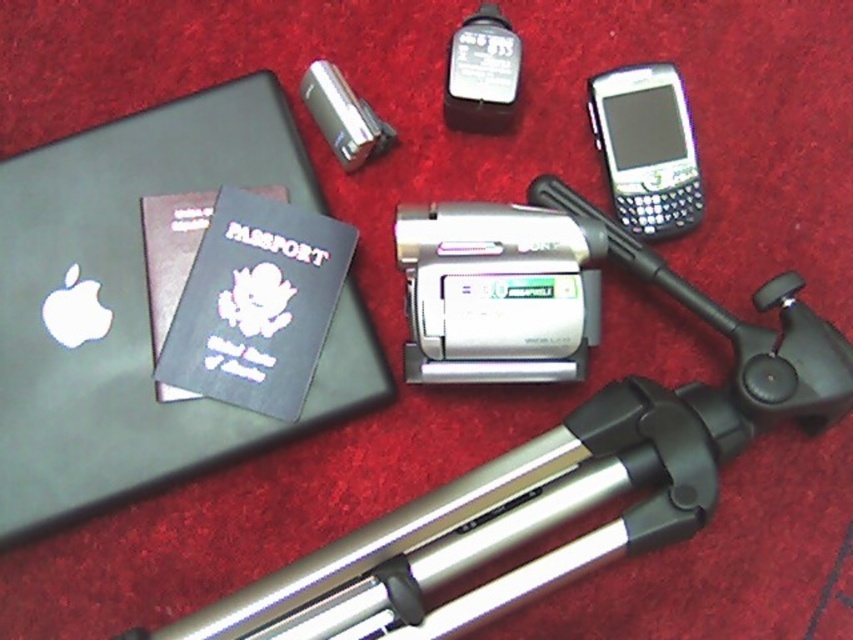
Find the location of a particular element. This screenshot has height=640, width=853. silver metallic video camera at center is located at coordinates (497, 292).

Can you confirm if silver metallic video camera at center is positioned above blue matte passport at center-left?

Yes.

Between point (576, 360) and point (273, 292), which one is positioned in front?

Point (576, 360) is more forward.

Where is `silver metallic video camera at center`? silver metallic video camera at center is located at coordinates (497, 292).

Between matte black laptop at upper left and black glossy smartphone at upper right, which one is positioned lower?

matte black laptop at upper left

Is matte black laptop at upper left smaller than black glossy smartphone at upper right?

Incorrect, matte black laptop at upper left is not smaller in size than black glossy smartphone at upper right.

The height and width of the screenshot is (640, 853). In order to click on matte black laptop at upper left in this screenshot , I will do `click(138, 304)`.

Is silver metallic video camera at center thinner than black glossy smartphone at upper right?

Incorrect, silver metallic video camera at center's width is not less than black glossy smartphone at upper right's.

Can you confirm if silver metallic video camera at center is positioned below black glossy smartphone at upper right?

Yes.

Measure the distance between silver metallic video camera at center and camera.

The distance of silver metallic video camera at center from camera is 4.12 feet.

Identify the location of silver metallic video camera at center. The width and height of the screenshot is (853, 640). (497, 292).